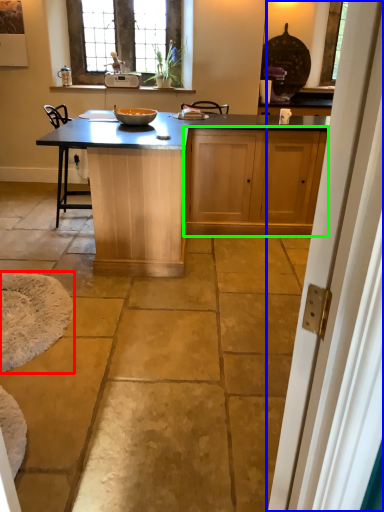
Question: Considering the real-world distances, which object is farthest from wide (highlighted by a red box)? screen door (highlighted by a blue box) or cabinetry (highlighted by a green box)?

Choices:
 (A) screen door
 (B) cabinetry

Answer: (A)